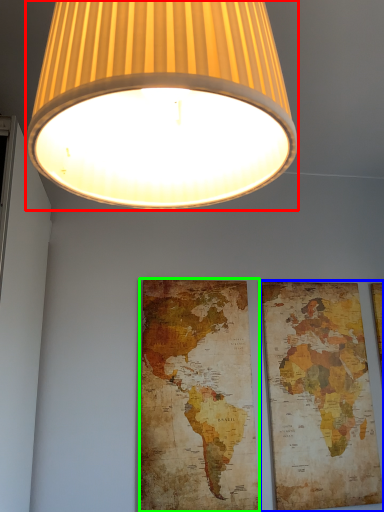
Question: Which object is the farthest from lamp (highlighted by a red box)? Choose among these: picture frame (highlighted by a blue box) or map (highlighted by a green box).

Choices:
 (A) picture frame
 (B) map

Answer: (A)